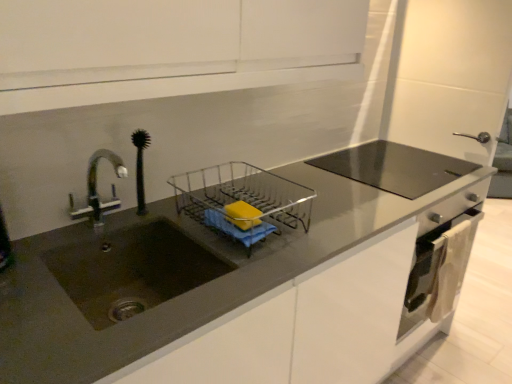
Question: Is clear plastic dish rack at center placed right next to yellow matte soap at center?

Choices:
 (A) no
 (B) yes

Answer: (A)

Question: Is clear plastic dish rack at center at the right side of yellow matte soap at center?

Choices:
 (A) no
 (B) yes

Answer: (A)

Question: Can we say clear plastic dish rack at center lies outside yellow matte soap at center?

Choices:
 (A) no
 (B) yes

Answer: (B)

Question: Can you confirm if clear plastic dish rack at center is bigger than yellow matte soap at center?

Choices:
 (A) no
 (B) yes

Answer: (B)

Question: Is clear plastic dish rack at center not near yellow matte soap at center?

Choices:
 (A) no
 (B) yes

Answer: (A)

Question: Is matte gray countertop at center inside the boundaries of clear plastic dish rack at center, or outside?

Choices:
 (A) inside
 (B) outside

Answer: (B)

Question: From a real-world perspective, is matte gray countertop at center above or below clear plastic dish rack at center?

Choices:
 (A) above
 (B) below

Answer: (B)

Question: Is matte gray countertop at center bigger or smaller than clear plastic dish rack at center?

Choices:
 (A) small
 (B) big

Answer: (B)

Question: From the image's perspective, relative to clear plastic dish rack at center, is matte gray countertop at center above or below?

Choices:
 (A) above
 (B) below

Answer: (B)

Question: Based on their sizes in the image, would you say clear plastic dish rack at center is bigger or smaller than yellow matte soap at center?

Choices:
 (A) small
 (B) big

Answer: (B)

Question: Is point (202, 208) closer or farther from the camera than point (257, 218)?

Choices:
 (A) closer
 (B) farther

Answer: (B)

Question: Do you think clear plastic dish rack at center is within yellow matte soap at center, or outside of it?

Choices:
 (A) outside
 (B) inside

Answer: (A)

Question: From a real-world perspective, is clear plastic dish rack at center positioned above or below yellow matte soap at center?

Choices:
 (A) above
 (B) below

Answer: (B)

Question: In terms of width, does satin silver oven at lower right look wider or thinner when compared to matte dark brown sink at left?

Choices:
 (A) wide
 (B) thin

Answer: (B)

Question: From a real-world perspective, relative to matte dark brown sink at left, is satin silver oven at lower right vertically above or below?

Choices:
 (A) below
 (B) above

Answer: (A)